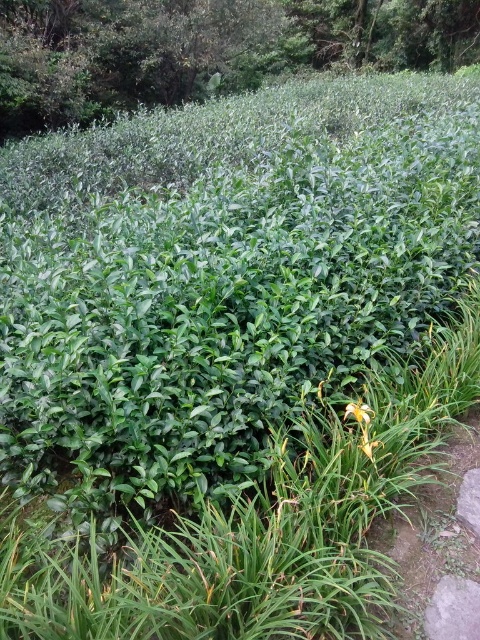
You are a gardener who needs to place a small statue between the green leafy bush at upper center and the yellow matte flower at lower right. Based on their widths, which object should you position the statue closer to?

The green leafy bush at upper center might be wider than yellow matte flower at lower right, so you should position the statue closer to the yellow matte flower at lower right to ensure it fits within the available space.

You are a gardener planning to plant new flowers in the tea plantation. You notice the green leafy bush at upper center and the yellow matte flower at lower center. Which plant has a wider spread? Please base your answer on the scene description provided.

The green leafy bush at upper center has a wider spread than the yellow matte flower at lower center, as its width surpasses that of the flower.

You are standing in the tea plantation and want to take a photo of the green leafy bush at upper center. To ensure it is centered in your camera viewfinder, where should you aim your camera? Please provide coordinates in the format of a point like this example format, e.g., point at point X, Y.

You should aim your camera at point [204,49] to center the green leafy bush at upper center in the viewfinder.